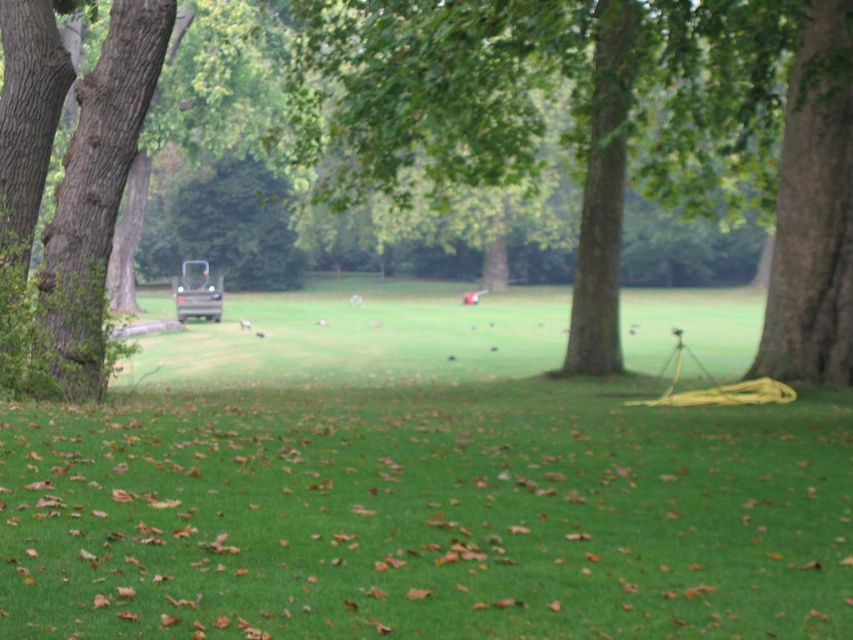
Question: Which point is closer to the camera?

Choices:
 (A) (769, 65)
 (B) (494, 410)

Answer: (B)

Question: Which point appears closest to the camera in this image?

Choices:
 (A) (480, 45)
 (B) (788, 566)

Answer: (B)

Question: Does green grass at center have a smaller size compared to brown rough tree at center?

Choices:
 (A) yes
 (B) no

Answer: (A)

Question: Can you confirm if green grass at center is bigger than brown rough tree at center?

Choices:
 (A) yes
 (B) no

Answer: (B)

Question: Does green grass at center have a greater width compared to brown rough tree at center?

Choices:
 (A) yes
 (B) no

Answer: (A)